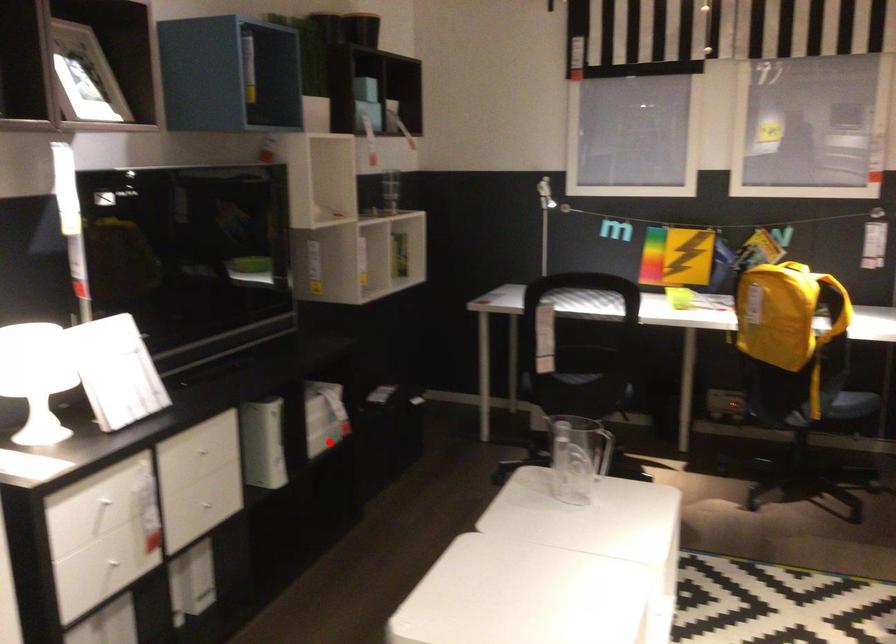
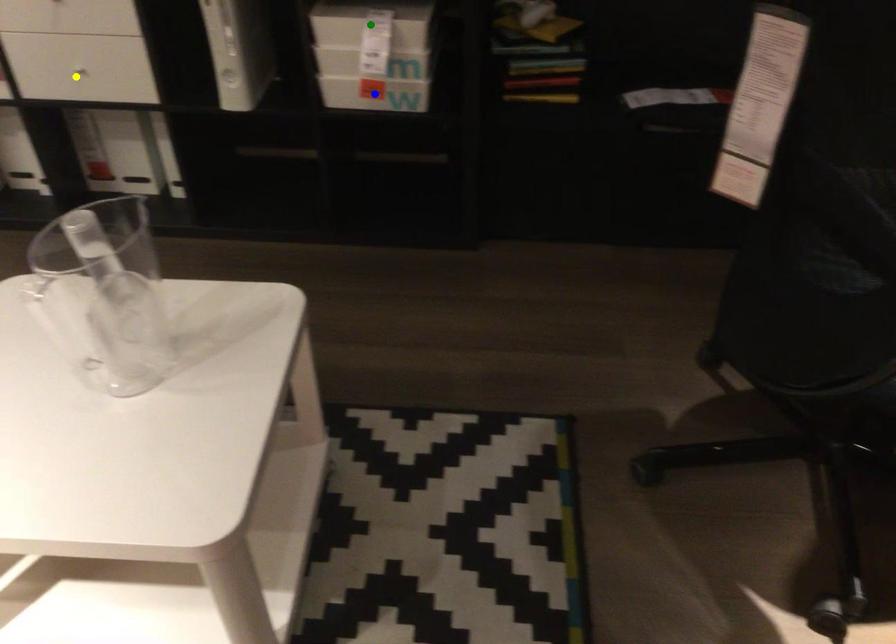
Question: I am providing you with two images of the same scene from different viewpoints. A red point is marked on the first image. You are given multiple points on the second image. Which point in image 2 is actually the same real-world point as the red point in image 1?

Choices:
 (A) green point
 (B) blue point
 (C) yellow point

Answer: (B)